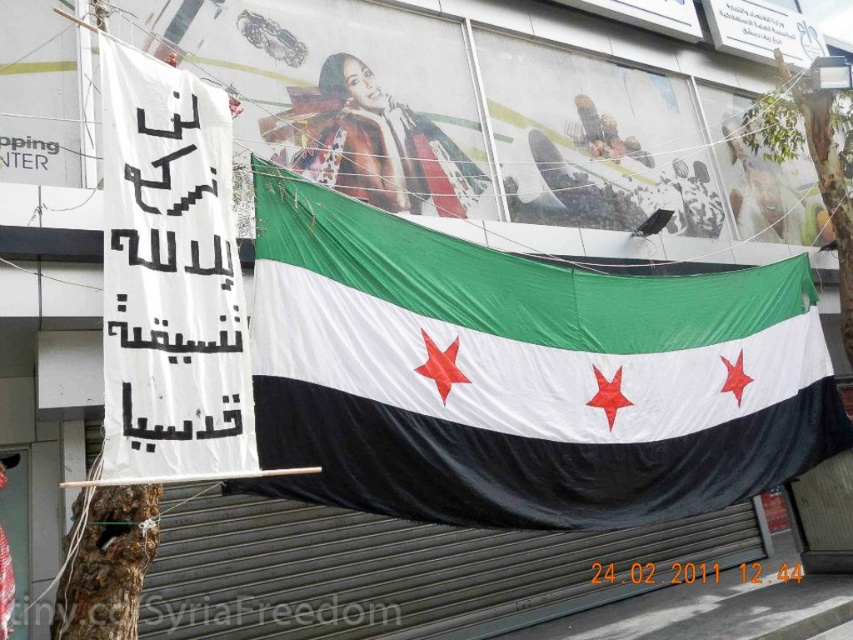
Identify the location of textured fabric flag at center. (520, 376).

Can you confirm if textured fabric flag at center is bigger than matte red scarf at center?

Yes.

Which is in front, point (604, 289) or point (341, 179)?

Positioned in front is point (604, 289).

At what (x,y) coordinates should I click in order to perform the action: click on textured fabric flag at center. Please return your answer as a coordinate pair (x, y). Looking at the image, I should click on (520, 376).